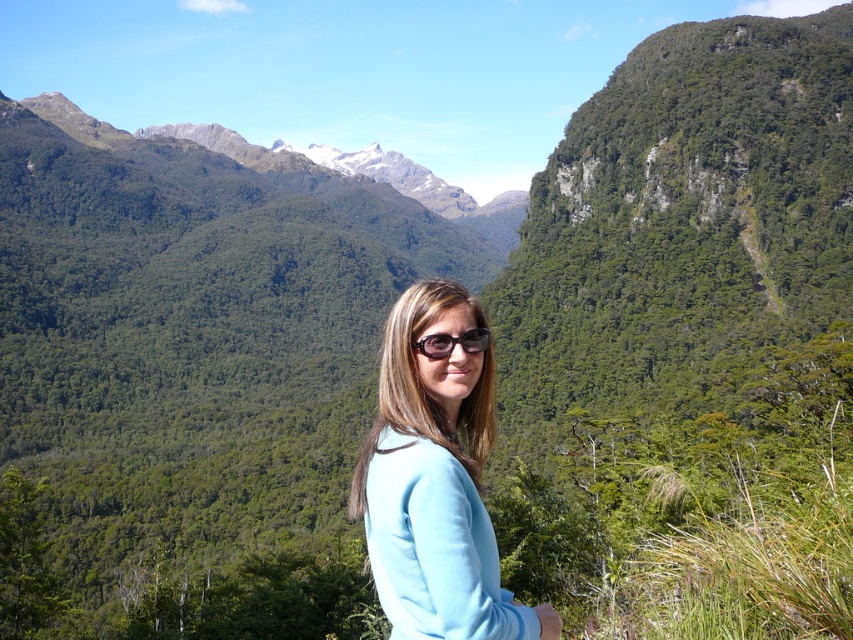
Question: Is light blue fabric at center further to the viewer compared to black plastic sunglasses at center?

Choices:
 (A) yes
 (B) no

Answer: (B)

Question: Can you confirm if light blue fabric at center is positioned to the left of black plastic sunglasses at center?

Choices:
 (A) yes
 (B) no

Answer: (A)

Question: Which object appears closest to the camera in this image?

Choices:
 (A) light blue fabric at center
 (B) black plastic sunglasses at center

Answer: (A)

Question: Does light blue fabric at center appear under black plastic sunglasses at center?

Choices:
 (A) no
 (B) yes

Answer: (B)